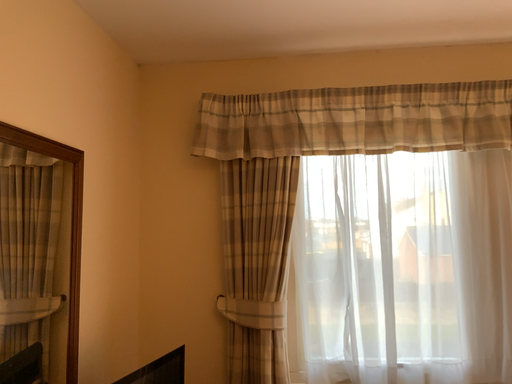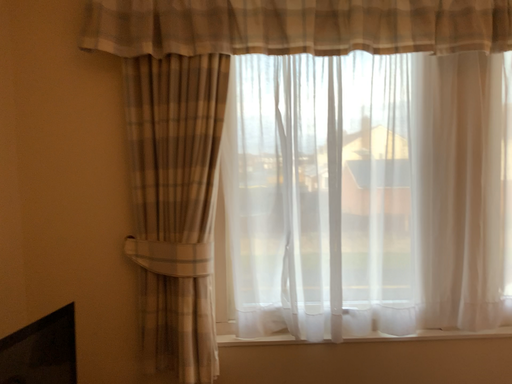
Question: Which way did the camera rotate in the video?

Choices:
 (A) rotated left
 (B) rotated right

Answer: (B)